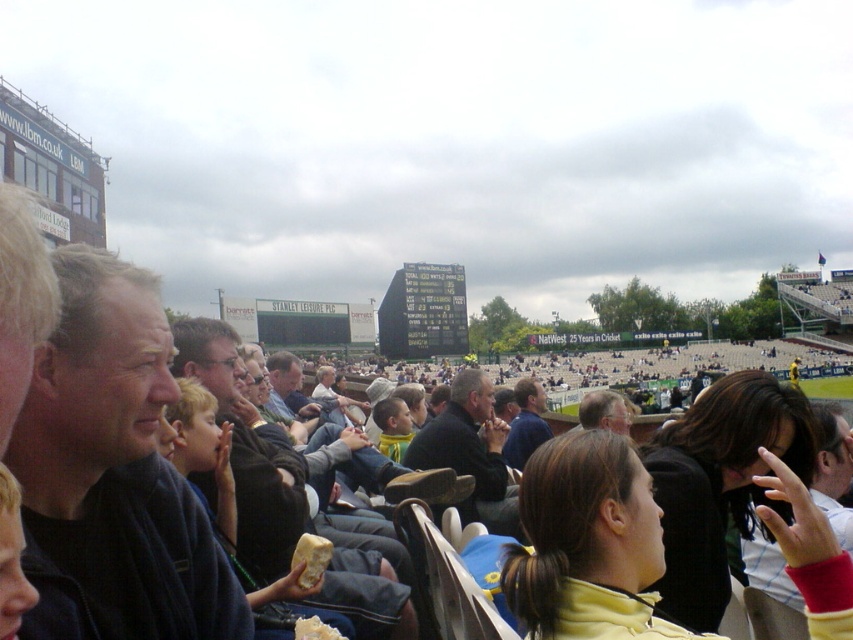
Is dark brown hair at center wider than dark brown leather jacket at center?

Indeed, dark brown hair at center has a greater width compared to dark brown leather jacket at center.

Which is in front, point (730, 474) or point (482, 413)?

Point (730, 474)

What do you see at coordinates (720, 483) in the screenshot? This screenshot has width=853, height=640. I see `dark brown hair at center` at bounding box center [720, 483].

Find the location of a particular element. dark brown hair at center is located at coordinates (720, 483).

Between dark blue fleece at center and matte black jacket at center, which one has more height?

Standing taller between the two is dark blue fleece at center.

Is dark blue fleece at center thinner than matte black jacket at center?

In fact, dark blue fleece at center might be wider than matte black jacket at center.

Is point (401, 550) positioned in front of point (625, 410)?

Yes.

Locate an element on the screen. This screenshot has width=853, height=640. dark blue fleece at center is located at coordinates (248, 449).

Is dark blue fleece at center shorter than dark blue shirt at center?

No.

Does dark blue fleece at center lie in front of dark blue shirt at center?

Yes, dark blue fleece at center is closer to the viewer.

Identify the location of dark blue fleece at center. (248, 449).

Where is `dark blue fleece at center`? dark blue fleece at center is located at coordinates (248, 449).